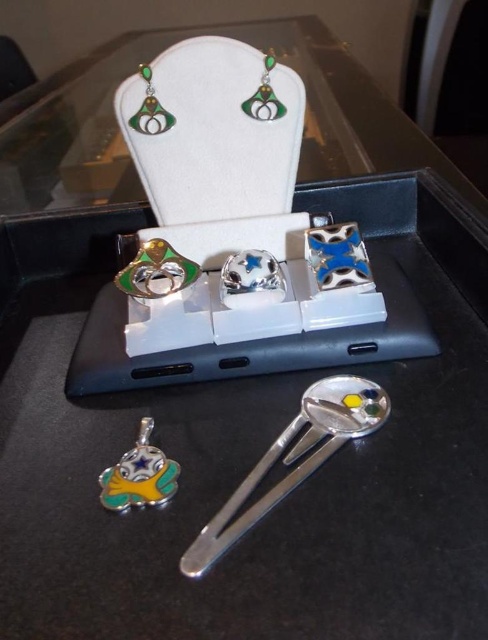
Question: Can you confirm if metallic pendant at center is thinner than green enamel earring at upper center?

Choices:
 (A) no
 (B) yes

Answer: (A)

Question: Is shiny silver spoon at lower center positioned before metallic pendant at center?

Choices:
 (A) no
 (B) yes

Answer: (B)

Question: Which point is farther to the camera?

Choices:
 (A) shiny silver spoon at lower center
 (B) metallic pendant at center

Answer: (B)

Question: Which of these objects is positioned closest to the metallic pendant at center?

Choices:
 (A) shiny silver spoon at lower center
 (B) green enamel earring at upper center

Answer: (A)

Question: Which of the following is the farthest from the observer?

Choices:
 (A) (304, 465)
 (B) (143, 454)
 (C) (268, 54)

Answer: (C)

Question: Does shiny silver spoon at lower center appear over metallic pendant at center?

Choices:
 (A) yes
 (B) no

Answer: (B)